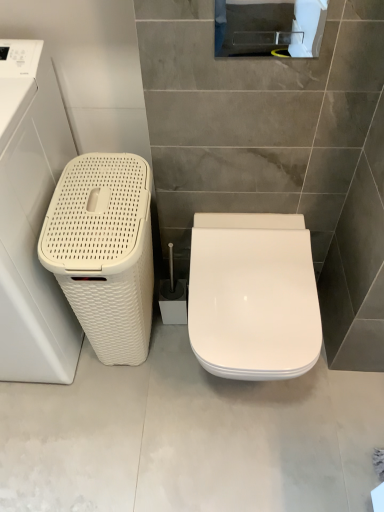
Identify the location of empty space that is ontop of white glossy toilet at center (from a real-world perspective). (182, 419).